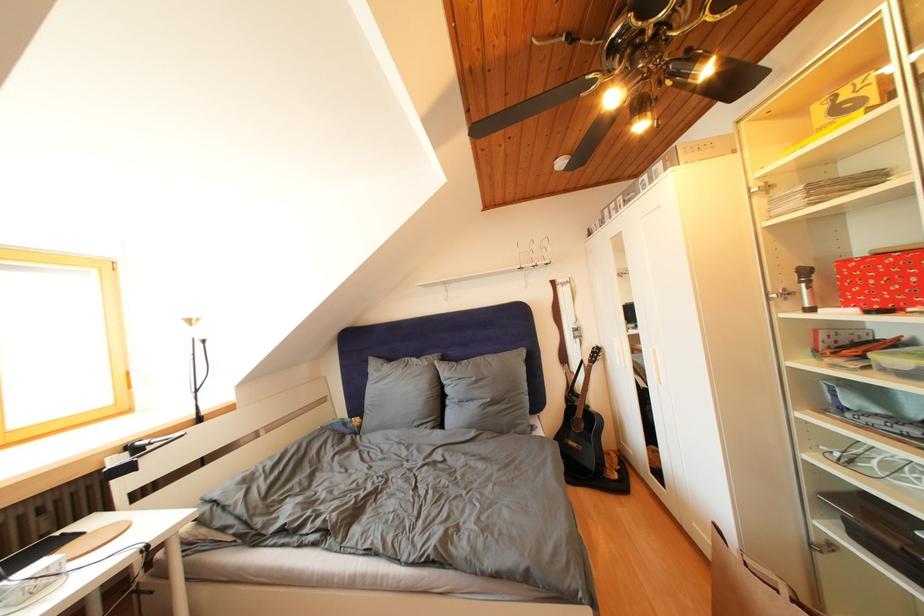
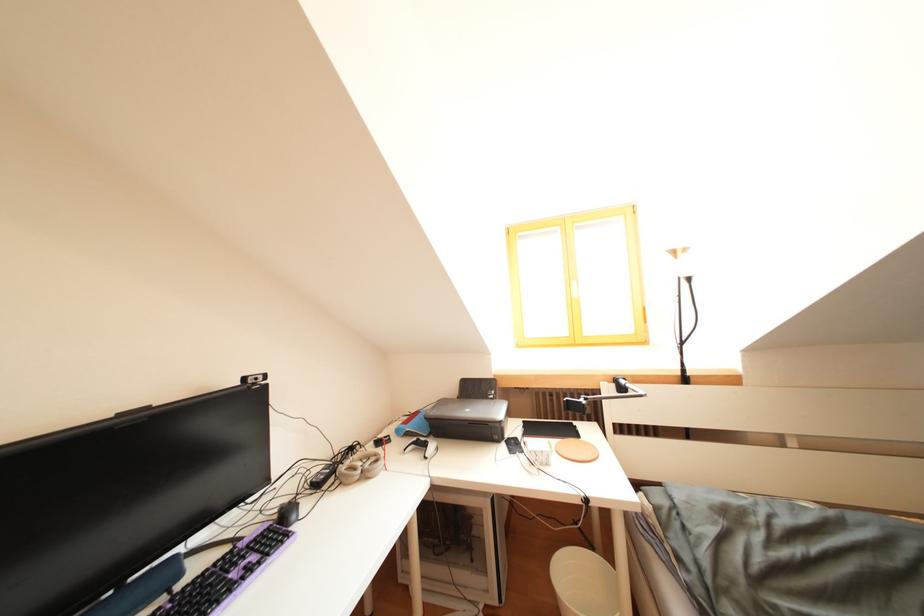
Question: The camera is either moving clockwise (left) or counter-clockwise (right) around the object. The first image is from the beginning of the video and the second image is from the end. Is the camera moving left or right when shooting the video?

Choices:
 (A) Left
 (B) Right

Answer: (B)